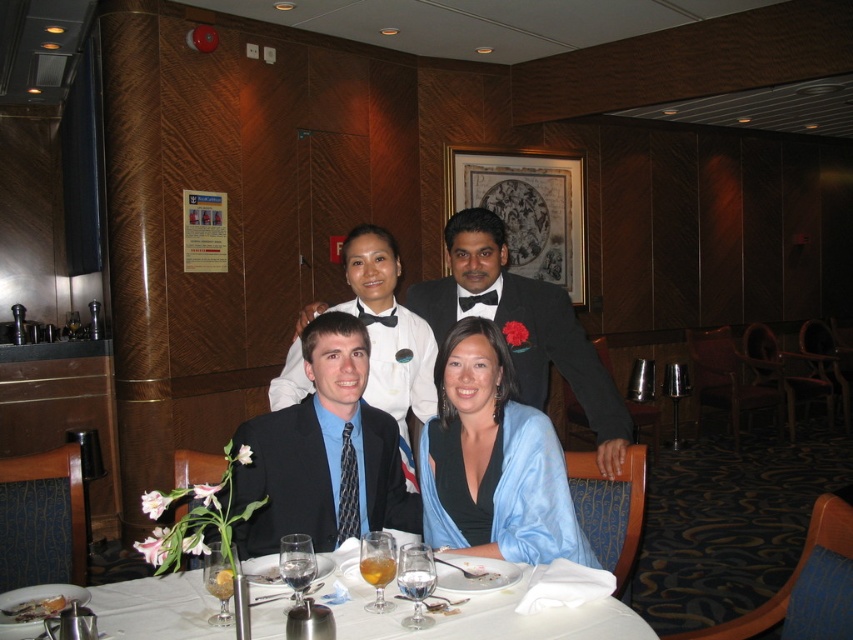
Question: Does black satin suit at center have a larger size compared to black satin bow tie at upper center?

Choices:
 (A) no
 (B) yes

Answer: (A)

Question: Does blue satin blouse at center have a smaller size compared to white cloth at lower center?

Choices:
 (A) yes
 (B) no

Answer: (B)

Question: Is blue satin blouse at center bigger than black satin bow tie at upper center?

Choices:
 (A) yes
 (B) no

Answer: (B)

Question: Which of these objects is positioned closest to the black satin bow tie at upper center?

Choices:
 (A) black satin suit at center
 (B) white cloth at lower center
 (C) blue satin blouse at center

Answer: (C)

Question: Which point is closer to the camera?

Choices:
 (A) blue satin blouse at center
 (B) white cloth at lower center
 (C) black satin bow tie at upper center

Answer: (B)

Question: Based on their relative distances, which object is farther from the white cloth at lower center?

Choices:
 (A) black satin bow tie at upper center
 (B) blue satin blouse at center

Answer: (A)